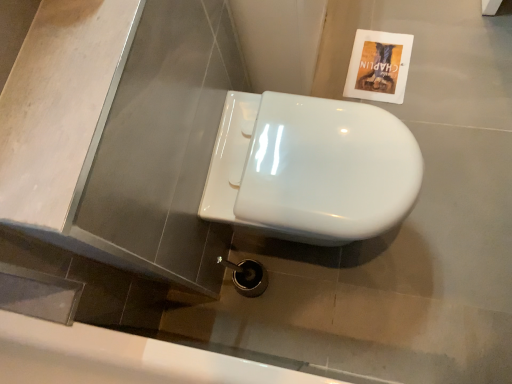
The width and height of the screenshot is (512, 384). Find the location of `free space underneath matte paper flyer at upper right (from a real-world perspective)`. free space underneath matte paper flyer at upper right (from a real-world perspective) is located at coordinates (376, 61).